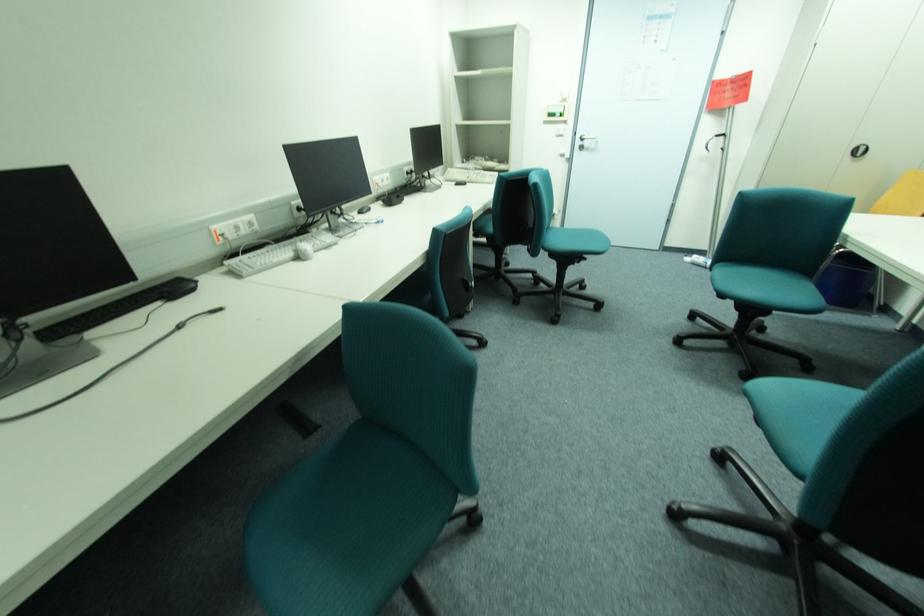
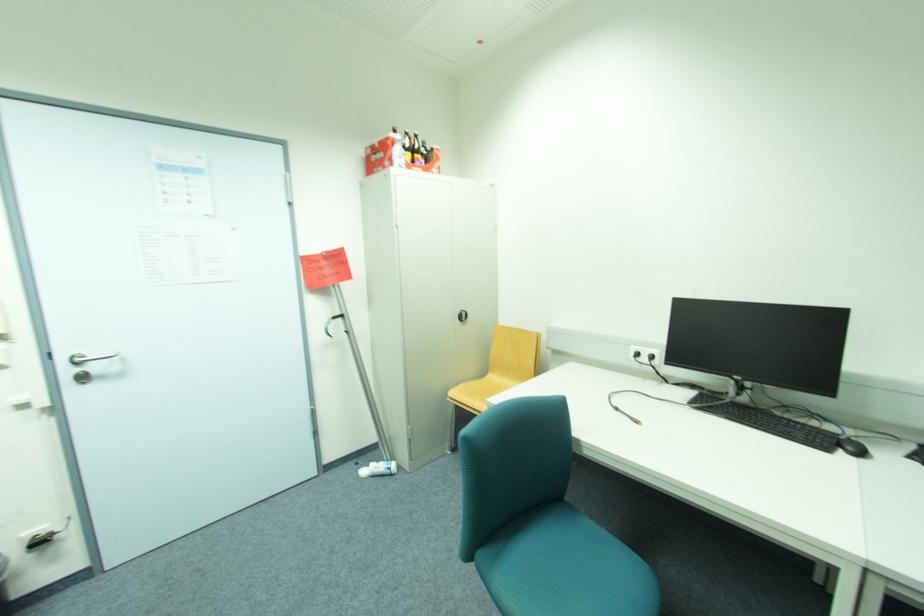
Where in the second image is the point corresponding to pixel 724 136 from the first image?

(339, 317)